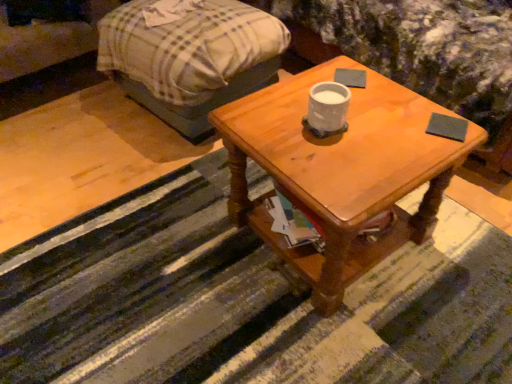
You are a GUI agent. You are given a task and a screenshot of the screen. Output one action in this format:
    pyautogui.click(x=<x>, y=<y>)
    Task: Click on the free space to the left of plaid fabric bed at upper left
    The height and width of the screenshot is (384, 512).
    Given the screenshot: What is the action you would take?
    pyautogui.click(x=69, y=140)